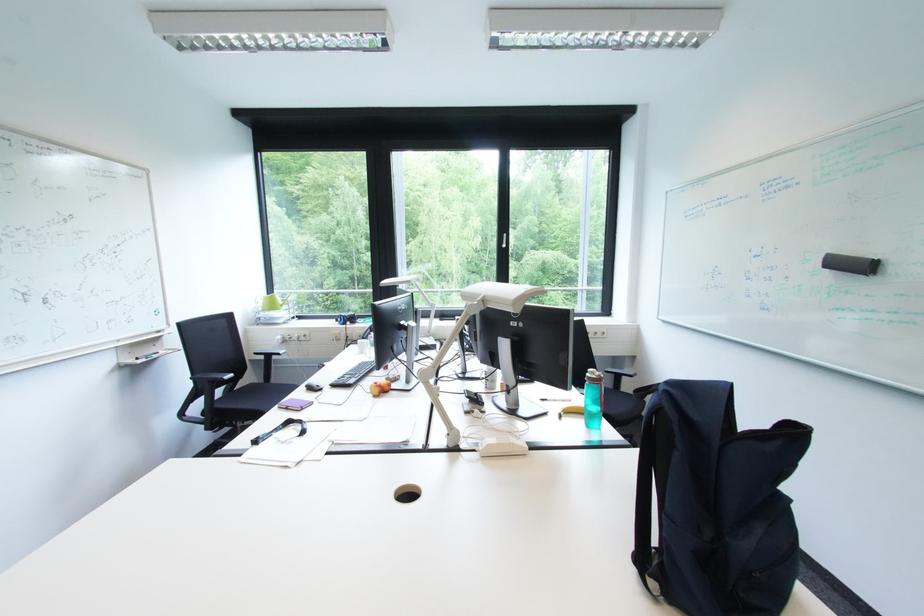
Where would you grasp the black whiteboard eraser? Please return your answer as a coordinate pair (x, y).

(850, 264)